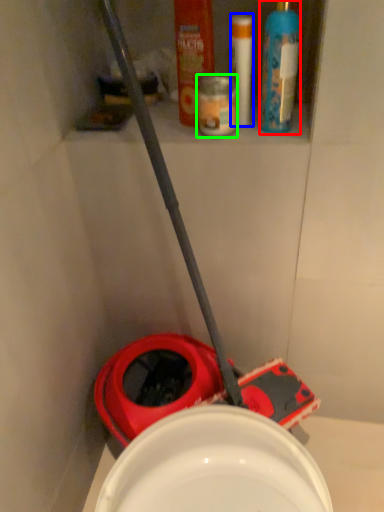
Question: Which is farther away from cleaning product (highlighted by a red box)? toiletry (highlighted by a blue box) or toiletry (highlighted by a green box)?

Choices:
 (A) toiletry
 (B) toiletry

Answer: (B)